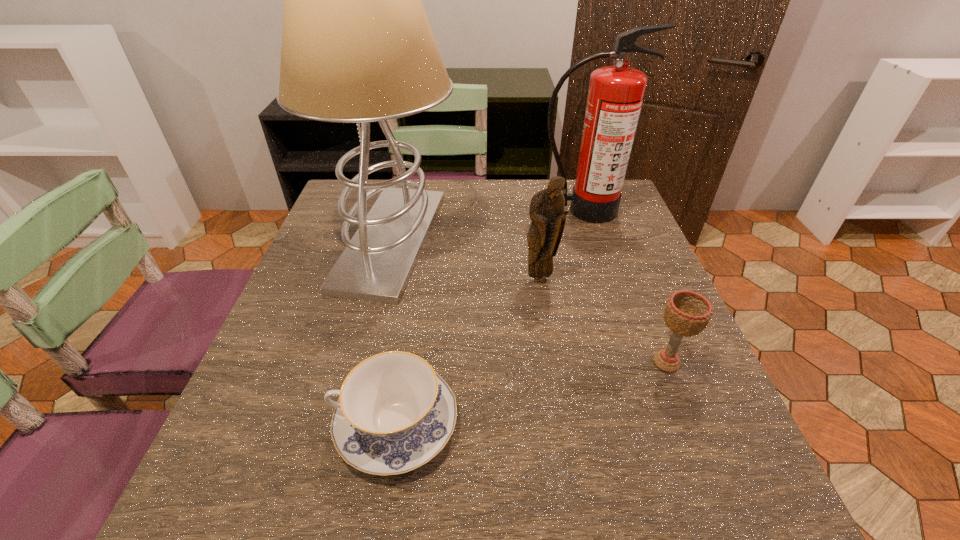
You are a GUI agent. You are given a task and a screenshot of the screen. Output one action in this format:
    pyautogui.click(x=<x>, y=<y>)
    Task: Click on the tallest object
    The image size is (960, 540).
    Given the screenshot: What is the action you would take?
    pyautogui.click(x=357, y=47)

I want to click on the fourth shortest object, so pyautogui.click(x=615, y=96).

Identify the location of the third tallest object. (546, 211).

Identify the location of the fourth tallest object. (687, 313).

Image resolution: width=960 pixels, height=540 pixels. I want to click on chinaware, so click(x=395, y=413).

This screenshot has height=540, width=960. Identify the location of vacant space situated on the front of the tallest object. (361, 359).

Locate an element on the screen. This screenshot has width=960, height=540. free region located on the front-facing side of the fire extinguisher is located at coordinates (612, 297).

This screenshot has height=540, width=960. Identify the location of free spot located on the front-facing side of the figurine. (565, 440).

Locate an element on the screen. This screenshot has width=960, height=540. vacant area situated on the back of the chalice is located at coordinates (616, 235).

Locate an element on the screen. The image size is (960, 540). vacant area situated 0.170m with the handle on the side of the shortest object is located at coordinates (231, 424).